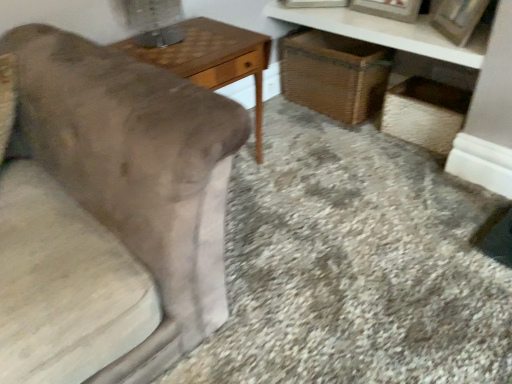
The width and height of the screenshot is (512, 384). Find the location of `free space in front of woodenobject at left`. free space in front of woodenobject at left is located at coordinates (258, 227).